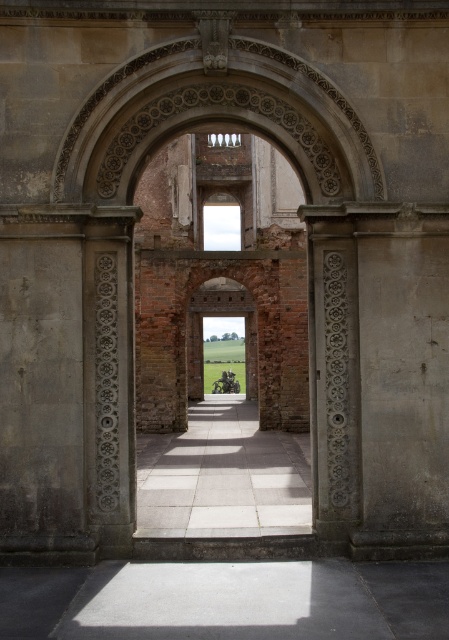
You are an architect designing a new courtyard. You want to place a decorative statue on the path that is as wide as the smooth stone pillar at center. Can the statue fit on the white stone path at center without overhanging the edges?

The smooth stone pillar at center has a lesser width compared to white stone path at center. Since the statue is designed to be as wide as the pillar, it will fit on the path without overhanging the edges because the path is wider than the pillar.

You are a visitor walking towards the grand archway and notice the smooth stone pillar at center and the white stone path at center. Which object is smaller in size?

The smooth stone pillar at center is smaller than the white stone path at center according to the description.